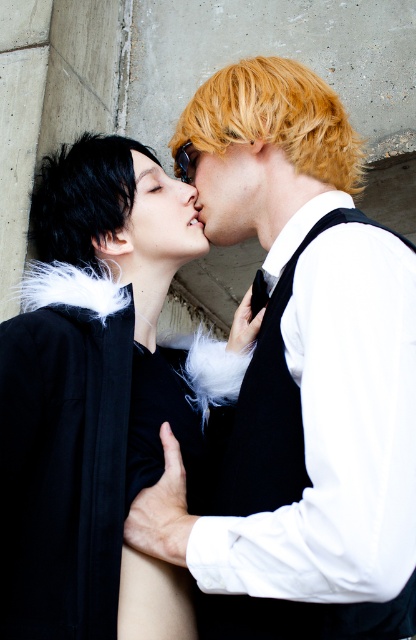
From the picture: Does black feathered coat at left appear on the right side of blonde hair at center?

Incorrect, black feathered coat at left is not on the right side of blonde hair at center.

Is point (27, 531) closer to camera compared to point (309, 83)?

That is True.

Between point (91, 588) and point (264, 116), which one is positioned behind?

Positioned behind is point (264, 116).

Identify the location of black feathered coat at left. (93, 397).

Does smooth blonde wig at center appear under blonde hair at center?

Correct, smooth blonde wig at center is located below blonde hair at center.

Between smooth blonde wig at center and blonde hair at center, which one is positioned lower?

smooth blonde wig at center is below.

Is point (141, 540) in front of point (200, 138)?

Yes, it is.

At what (x,y) coordinates should I click in order to perform the action: click on smooth blonde wig at center. Please return your answer as a coordinate pair (x, y). Looking at the image, I should click on (299, 378).

Does black feathered coat at left have a greater height compared to smooth blonde hair at center?

Indeed, black feathered coat at left has a greater height compared to smooth blonde hair at center.

In the scene shown: Can you confirm if black feathered coat at left is positioned above smooth blonde hair at center?

No.

From the picture: Who is more distant from viewer, (109, 600) or (215, 166)?

The point (215, 166) is more distant.

Identify the location of black feathered coat at left. (93, 397).